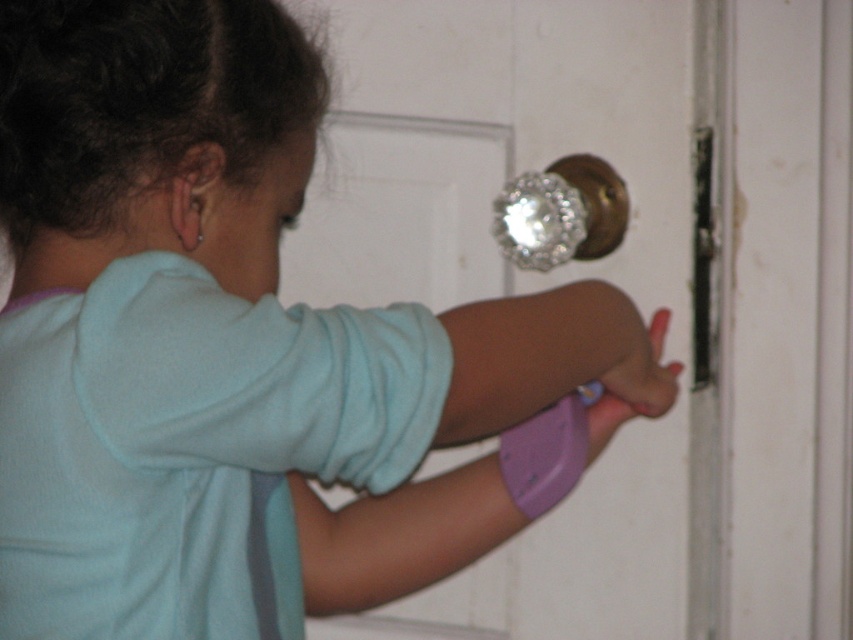
Question: Which of the following is the closest to the observer?

Choices:
 (A) dull metallic knob at upper right
 (B) purple matte wristband at lower center

Answer: (B)

Question: Which object is farther from the camera taking this photo?

Choices:
 (A) purple matte wristband at lower center
 (B) dull metallic knob at upper right

Answer: (B)

Question: Does shiny brass doorknob at center have a greater width compared to dull metallic knob at upper right?

Choices:
 (A) yes
 (B) no

Answer: (A)

Question: Estimate the real-world distances between objects in this image. Which object is farther from the purple matte wristband at lower center?

Choices:
 (A) shiny brass doorknob at center
 (B) dull metallic knob at upper right

Answer: (A)

Question: Does shiny brass doorknob at center appear on the right side of purple matte wristband at lower center?

Choices:
 (A) yes
 (B) no

Answer: (B)

Question: Can you confirm if dull metallic knob at upper right is smaller than purple matte wristband at lower center?

Choices:
 (A) no
 (B) yes

Answer: (B)